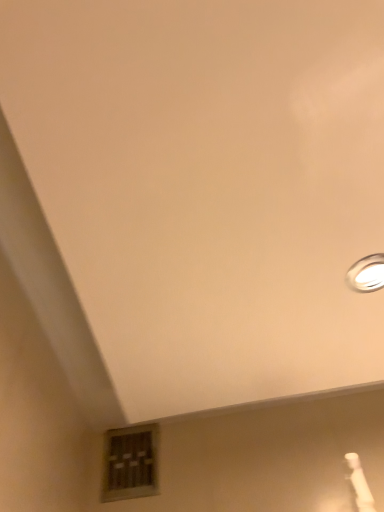
Question: Is wooden window at lower center wider or thinner than white glossy lamp at upper right?

Choices:
 (A) wide
 (B) thin

Answer: (B)

Question: In the image, is wooden window at lower center on the left side or the right side of white glossy lamp at upper right?

Choices:
 (A) right
 (B) left

Answer: (B)

Question: From their relative heights in the image, would you say wooden window at lower center is taller or shorter than white glossy lamp at upper right?

Choices:
 (A) short
 (B) tall

Answer: (B)

Question: Is white glossy lamp at upper right bigger or smaller than wooden window at lower center?

Choices:
 (A) small
 (B) big

Answer: (A)

Question: From the image's perspective, is white glossy lamp at upper right located above or below wooden window at lower center?

Choices:
 (A) below
 (B) above

Answer: (B)

Question: In the image, is white glossy lamp at upper right positioned in front of or behind wooden window at lower center?

Choices:
 (A) behind
 (B) front

Answer: (B)

Question: From their relative heights in the image, would you say white glossy lamp at upper right is taller or shorter than wooden window at lower center?

Choices:
 (A) short
 (B) tall

Answer: (A)